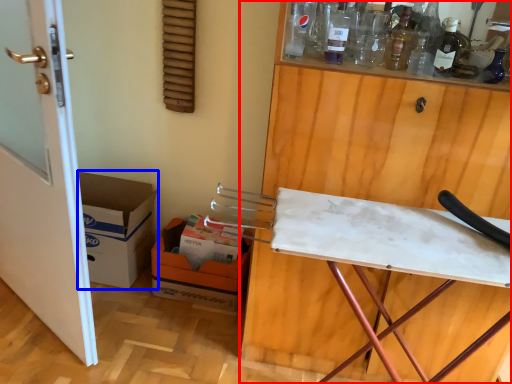
Question: Among these objects, which one is farthest to the camera, cabinetry (highlighted by a red box) or cardboard box (highlighted by a blue box)?

Choices:
 (A) cabinetry
 (B) cardboard box

Answer: (B)